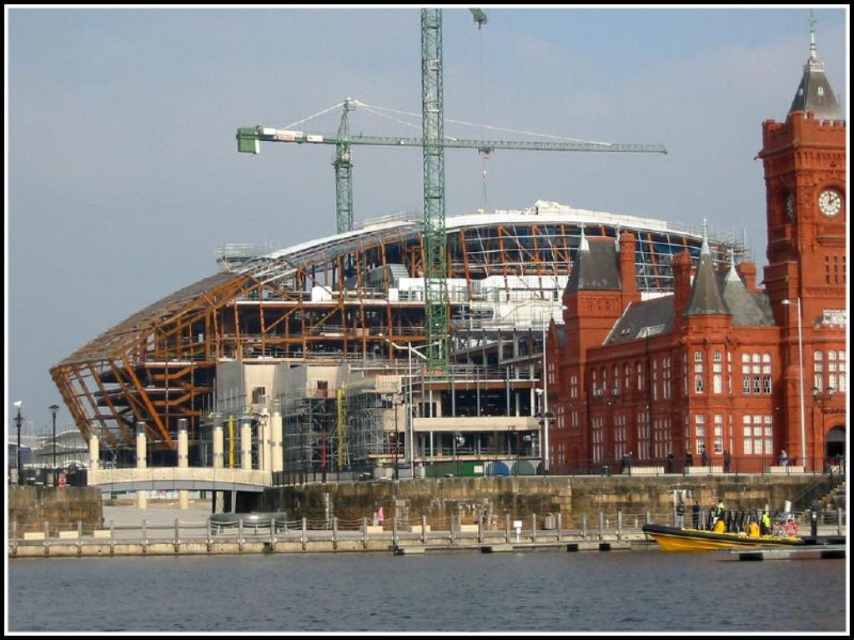
Question: Which object is the farthest from the yellow rubber boat at lower center?

Choices:
 (A) red brick clock tower at upper right
 (B) green metal crane at center
 (C) transparent water at lower center

Answer: (B)

Question: Does transparent water at lower center appear under green metal crane at center?

Choices:
 (A) yes
 (B) no

Answer: (A)

Question: Is transparent water at lower center further to camera compared to yellow rubber boat at lower center?

Choices:
 (A) yes
 (B) no

Answer: (B)

Question: Which is nearer to the yellow rubber boat at lower center?

Choices:
 (A) green metal crane at center
 (B) red brick clock tower at upper right

Answer: (B)

Question: Which object is positioned closest to the green metal crane at center?

Choices:
 (A) yellow rubber boat at lower center
 (B) red brick clock tower at upper right

Answer: (B)

Question: Can you confirm if transparent water at lower center is positioned above red brick clock tower at upper right?

Choices:
 (A) yes
 (B) no

Answer: (B)